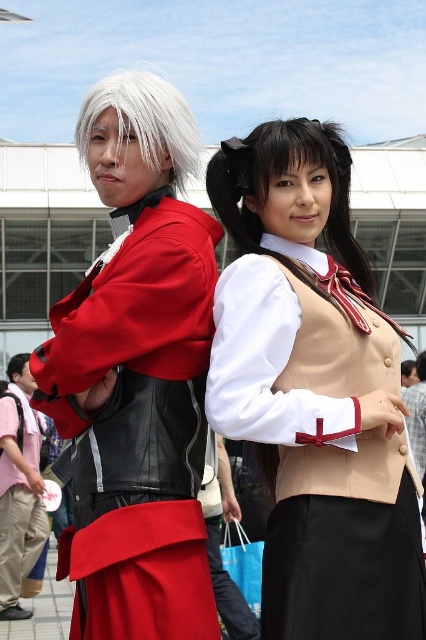
You are a photographer trying to capture a group photo of the beige fabric vest at center and whitehair at left. The camera you are using has a maximum focus range of 30 feet. Will both subjects be in focus?

The distance between beige fabric vest at center and whitehair at left is 36.15 feet, which exceeds the camera maximum focus range of 30 feet. Therefore, both subjects cannot be in focus at the same time.

You are a photographer at a cosplay event. You want to take a photo of the beige fabric vest at center and the whitehair at left. Which object is closer to the camera?

The beige fabric vest at center is closer to the camera because it is in front of the whitehair at left.